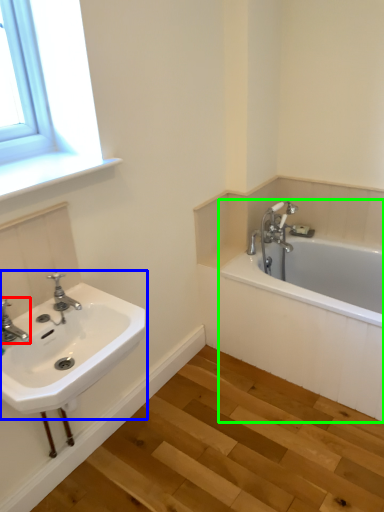
Question: Based on their relative distances, which object is nearer to tap (highlighted by a red box)? Choose from sink (highlighted by a blue box) and bathtub (highlighted by a green box).

Choices:
 (A) sink
 (B) bathtub

Answer: (A)